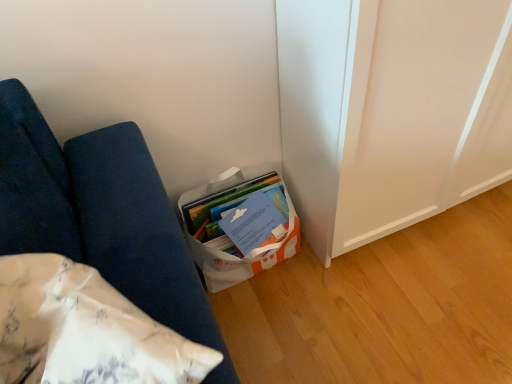
The image size is (512, 384). Describe the element at coordinates (101, 216) in the screenshot. I see `white fabric cushion at lower left` at that location.

Locate an element on the screen. The height and width of the screenshot is (384, 512). white fabric cushion at lower left is located at coordinates (101, 216).

What do you see at coordinates (239, 215) in the screenshot?
I see `white paper bag at lower center` at bounding box center [239, 215].

Where is `white paper bag at lower center`? The height and width of the screenshot is (384, 512). white paper bag at lower center is located at coordinates (239, 215).

I want to click on white fabric cushion at lower left, so click(x=101, y=216).

Which object is positioned more to the left, white fabric cushion at lower left or white paper bag at lower center?

white fabric cushion at lower left is more to the left.

Considering their positions, is white fabric cushion at lower left located in front of or behind white paper bag at lower center?

Visually, white fabric cushion at lower left is located in front of white paper bag at lower center.

Does point (148, 278) lie behind point (246, 182)?

No, (148, 278) is in front of (246, 182).

From the image's perspective, would you say white fabric cushion at lower left is shown under white paper bag at lower center?

Yes, from the image's perspective, white fabric cushion at lower left is beneath white paper bag at lower center.

From a real-world perspective, is white fabric cushion at lower left below white paper bag at lower center?

No.

Between white fabric cushion at lower left and white paper bag at lower center, which one has larger width?

white paper bag at lower center is wider.

Between white fabric cushion at lower left and white paper bag at lower center, which one has less height?

white paper bag at lower center is shorter.

Is white fabric cushion at lower left bigger or smaller than white paper bag at lower center?

Clearly, white fabric cushion at lower left is larger in size than white paper bag at lower center.

Is white fabric cushion at lower left not inside white paper bag at lower center?

Indeed, white fabric cushion at lower left is completely outside white paper bag at lower center.

Is white fabric cushion at lower left placed right next to white paper bag at lower center?

white fabric cushion at lower left is not next to white paper bag at lower center, and they're not touching.

Is white fabric cushion at lower left facing towards white paper bag at lower center?

No, white fabric cushion at lower left is not turned towards white paper bag at lower center.

What's the angular difference between white fabric cushion at lower left and white paper bag at lower center's facing directions?

45.1 degrees separate the facing orientations of white fabric cushion at lower left and white paper bag at lower center.

You are a GUI agent. You are given a task and a screenshot of the screen. Output one action in this format:
    pyautogui.click(x=<x>, y=<y>)
    Task: Click on the book that is above the white fabric cushion at lower left (from the image's perspective)
    This screenshot has width=512, height=384.
    Given the screenshot: What is the action you would take?
    pyautogui.click(x=239, y=215)

Which is more to the right, white paper bag at lower center or white fabric cushion at lower left?

From the viewer's perspective, white paper bag at lower center appears more on the right side.

From the picture: Between white paper bag at lower center and white fabric cushion at lower left, which one is positioned behind?

white paper bag at lower center.

Between point (251, 240) and point (120, 197), which one is positioned in front?

The point (120, 197) is closer.

From the image's perspective, is white paper bag at lower center under white fabric cushion at lower left?

No.

Looking at this image, from a real-world perspective, is white paper bag at lower center beneath white fabric cushion at lower left?

Yes, from a real-world perspective, white paper bag at lower center is under white fabric cushion at lower left.

In the scene shown: Considering the relative sizes of white paper bag at lower center and white fabric cushion at lower left in the image provided, is white paper bag at lower center thinner than white fabric cushion at lower left?

Incorrect, the width of white paper bag at lower center is not less than that of white fabric cushion at lower left.

Which of these two, white paper bag at lower center or white fabric cushion at lower left, stands taller?

white fabric cushion at lower left is taller.

Considering the sizes of white paper bag at lower center and white fabric cushion at lower left in the image, is white paper bag at lower center bigger or smaller than white fabric cushion at lower left?

white paper bag at lower center is smaller than white fabric cushion at lower left.

In the scene shown: Do you think white paper bag at lower center is within white fabric cushion at lower left, or outside of it?

white paper bag at lower center is outside white fabric cushion at lower left.

Is white paper bag at lower center next to white fabric cushion at lower left and touching it?

No, white paper bag at lower center is not touching white fabric cushion at lower left.

Is white paper bag at lower center turned away from white fabric cushion at lower left?

No.

You are a GUI agent. You are given a task and a screenshot of the screen. Output one action in this format:
    pyautogui.click(x=<x>, y=<y>)
    Task: Click on the furniture above the white paper bag at lower center (from a real-world perspective)
    This screenshot has height=384, width=512.
    Given the screenshot: What is the action you would take?
    pyautogui.click(x=101, y=216)

You are a GUI agent. You are given a task and a screenshot of the screen. Output one action in this format:
    pyautogui.click(x=<x>, y=<y>)
    Task: Click on the furniture that appears on the left of white paper bag at lower center
    The height and width of the screenshot is (384, 512).
    Given the screenshot: What is the action you would take?
    pyautogui.click(x=101, y=216)

Identify the location of book on the right side of white fabric cushion at lower left. This screenshot has width=512, height=384. (239, 215).